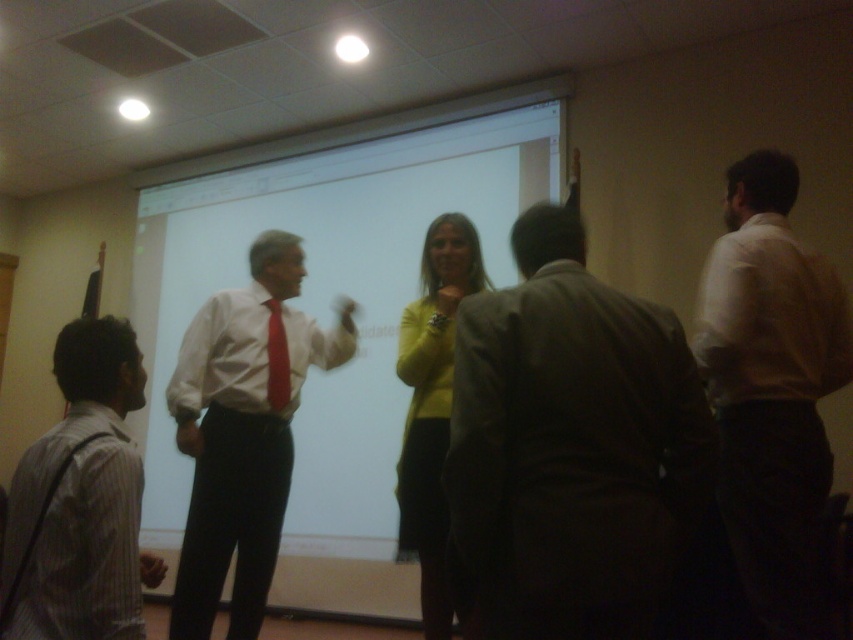
Can you confirm if white matte projection screen at center is shorter than yellow sweater at center?

No, white matte projection screen at center is not shorter than yellow sweater at center.

Locate an element on the screen. The width and height of the screenshot is (853, 640). white matte projection screen at center is located at coordinates (331, 296).

Find the location of a particular element. The image size is (853, 640). white matte projection screen at center is located at coordinates (331, 296).

Which is more to the right, white matte projection screen at center or striped cotton shirt at lower left?

From the viewer's perspective, white matte projection screen at center appears more on the right side.

Between point (563, 147) and point (138, 627), which one is positioned in front?

Positioned in front is point (138, 627).

This screenshot has height=640, width=853. I want to click on white matte projection screen at center, so click(331, 296).

Locate an element on the screen. This screenshot has height=640, width=853. white matte projection screen at center is located at coordinates coord(331,296).

Does dark gray suit at center have a larger size compared to white smooth shirt at right?

Incorrect, dark gray suit at center is not larger than white smooth shirt at right.

Which is more to the right, dark gray suit at center or white smooth shirt at right?

Positioned to the right is white smooth shirt at right.

Who is more distant from viewer, (683,544) or (733,422)?

The point (733,422) is more distant.

Find the location of a particular element. dark gray suit at center is located at coordinates 570,448.